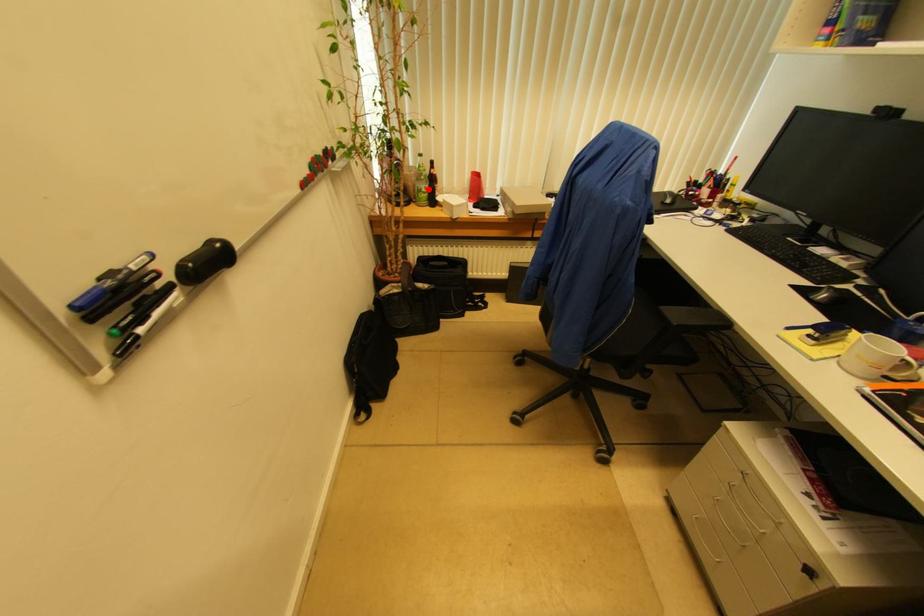
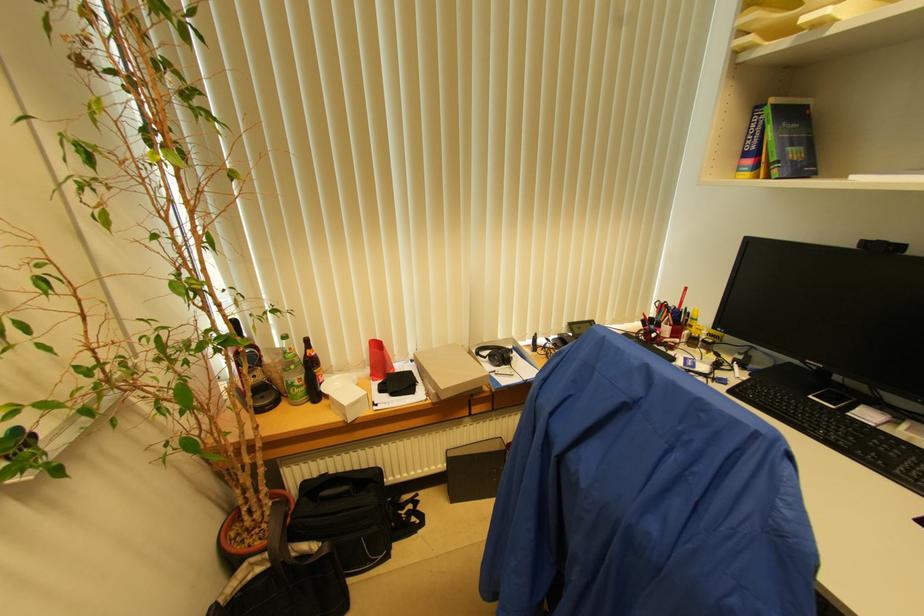
Where in the second image is the point corresponding to the highlighted location from the first image?

(304, 379)